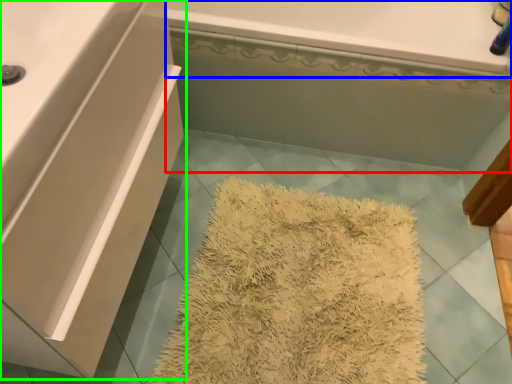
Question: Which object is the closest to the bath (highlighted by a red box)? Choose among these: bath (highlighted by a blue box) or bathroom cabinet (highlighted by a green box).

Choices:
 (A) bath
 (B) bathroom cabinet

Answer: (A)